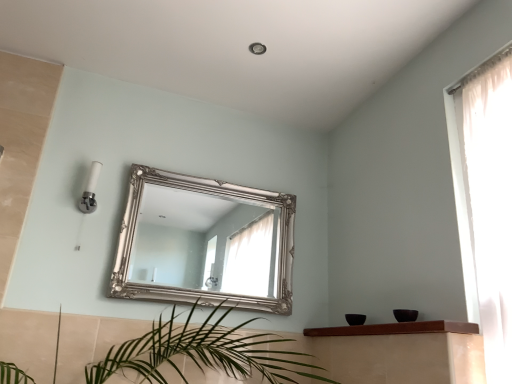
Question: Considering the relative sizes of brown wooden shelf at lower center and silver ornate mirror at center in the image provided, is brown wooden shelf at lower center bigger than silver ornate mirror at center?

Choices:
 (A) yes
 (B) no

Answer: (B)

Question: Is brown wooden shelf at lower center positioned before silver ornate mirror at center?

Choices:
 (A) yes
 (B) no

Answer: (A)

Question: From the image's perspective, would you say brown wooden shelf at lower center is positioned over silver ornate mirror at center?

Choices:
 (A) yes
 (B) no

Answer: (B)

Question: Is brown wooden shelf at lower center taller than silver ornate mirror at center?

Choices:
 (A) yes
 (B) no

Answer: (B)

Question: Are brown wooden shelf at lower center and silver ornate mirror at center beside each other?

Choices:
 (A) yes
 (B) no

Answer: (B)

Question: Is brown wooden shelf at lower center smaller than silver ornate mirror at center?

Choices:
 (A) no
 (B) yes

Answer: (B)

Question: Is silver ornate mirror at center at the right side of brown wooden shelf at lower center?

Choices:
 (A) yes
 (B) no

Answer: (B)

Question: Considering the relative sizes of silver ornate mirror at center and brown wooden shelf at lower center in the image provided, is silver ornate mirror at center wider than brown wooden shelf at lower center?

Choices:
 (A) no
 (B) yes

Answer: (A)

Question: Is silver ornate mirror at center thinner than brown wooden shelf at lower center?

Choices:
 (A) yes
 (B) no

Answer: (A)

Question: Would you say silver ornate mirror at center is a long distance from brown wooden shelf at lower center?

Choices:
 (A) yes
 (B) no

Answer: (A)

Question: Is silver ornate mirror at center placed right next to brown wooden shelf at lower center?

Choices:
 (A) yes
 (B) no

Answer: (B)

Question: Can you confirm if silver ornate mirror at center is taller than brown wooden shelf at lower center?

Choices:
 (A) yes
 (B) no

Answer: (A)

Question: Which is correct: silver ornate mirror at center is inside brown wooden shelf at lower center, or outside of it?

Choices:
 (A) outside
 (B) inside

Answer: (A)